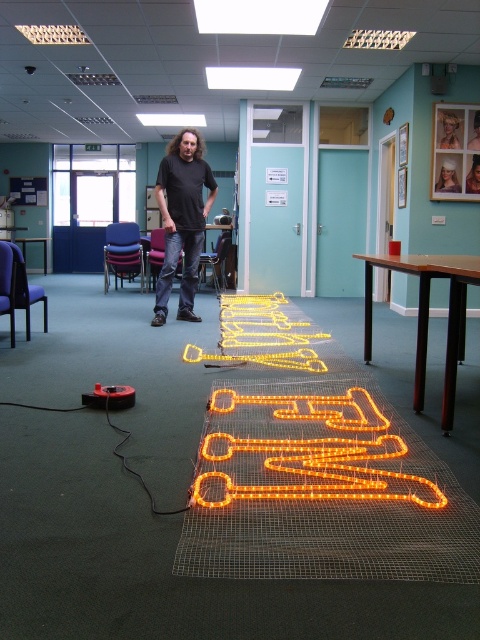
You are an event coordinator planning to place a 1.2 meter wide banner between the black matte shirt at center and the orange led lights at center. Can the space accommodate the banner?

The black matte shirt at center has a lesser width compared to orange led lights at center, so the space between them may not be sufficient to fit a 1.2 meter wide banner. Measure the actual distance before deciding.

You are an electrician tasked with connecting the orange wire neon sign at center and the orange led lights at center. According to the spatial arrangement, which object should be connected first to avoid tangling the wires?

The orange led lights at center should be connected first since the orange wire neon sign at center is to the right of them, allowing wires to be laid out without crossing over.